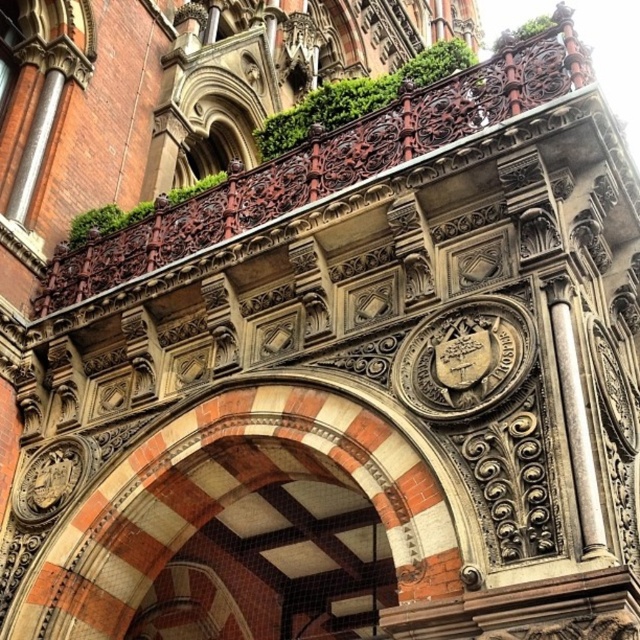
Which is behind, point (220, 432) or point (356, 116)?

Point (356, 116)

Where is `red brick arch at center`? The width and height of the screenshot is (640, 640). red brick arch at center is located at coordinates (228, 502).

Locate an element on the screen. red brick arch at center is located at coordinates (228, 502).

Is red brick arch at center in front of white marble column at center?

No.

Which is in front, point (195, 433) or point (572, 445)?

Point (572, 445) is more forward.

Where is `red brick arch at center`? This screenshot has height=640, width=640. red brick arch at center is located at coordinates (228, 502).

Can you confirm if green leafy ivy at upper center is positioned to the right of white marble column at center?

No, green leafy ivy at upper center is not to the right of white marble column at center.

You are a GUI agent. You are given a task and a screenshot of the screen. Output one action in this format:
    pyautogui.click(x=<x>, y=<y>)
    Task: Click on the green leafy ivy at upper center
    Image resolution: width=640 pixels, height=640 pixels.
    Given the screenshot: What is the action you would take?
    tap(356, 97)

Image resolution: width=640 pixels, height=640 pixels. I want to click on green leafy ivy at upper center, so click(x=356, y=97).